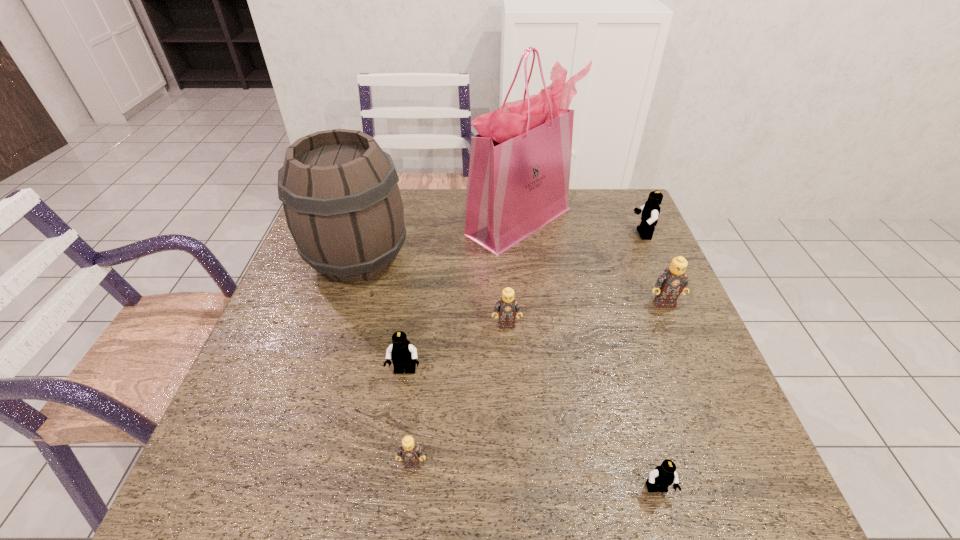
Locate an element on the screen. This screenshot has height=540, width=960. shopping bag is located at coordinates (519, 172).

What are the coordinates of `pink shopping bag` in the screenshot? It's located at (519, 172).

What are the coordinates of `the seventh shortest object` in the screenshot? It's located at (343, 207).

Find the location of `the biggest black Lego`. the biggest black Lego is located at coordinates (650, 211).

Where is `the farthest black Lego`? the farthest black Lego is located at coordinates (650, 211).

I want to click on the fourth farthest object, so click(673, 281).

Where is `the rightmost tan Lego`? the rightmost tan Lego is located at coordinates (673, 281).

Find the location of a particular element. The width and height of the screenshot is (960, 540). the fourth nearest Lego is located at coordinates (507, 307).

The width and height of the screenshot is (960, 540). What are the coordinates of `the second nearest tan Lego` in the screenshot? It's located at pos(507,307).

At what (x,y) coordinates should I click in order to perform the action: click on the leftmost black Lego. Please return your answer as a coordinate pair (x, y). Looking at the image, I should click on (402, 353).